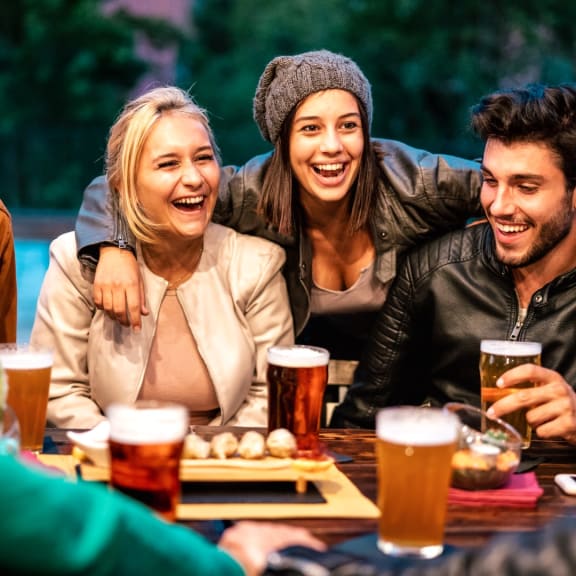
Where is `beer in glasses`? Image resolution: width=576 pixels, height=576 pixels. beer in glasses is located at coordinates (43, 415), (157, 481), (306, 396), (409, 488), (505, 375).